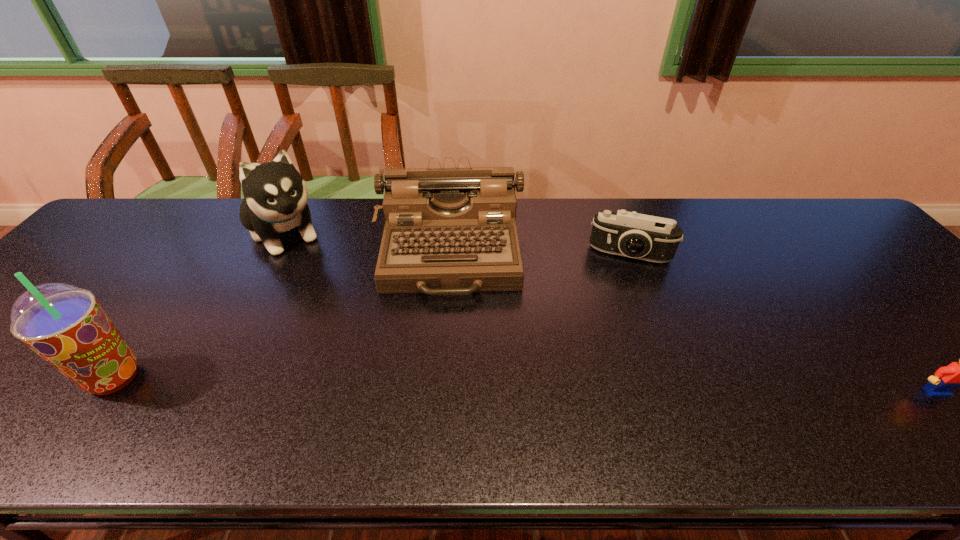
Locate an element on the screen. smoothie that is positioned at the near edge is located at coordinates (64, 324).

Find the location of a particular element. Image resolution: width=960 pixels, height=540 pixels. Lego situated at the near edge is located at coordinates (957, 374).

You are a GUI agent. You are given a task and a screenshot of the screen. Output one action in this format:
    pyautogui.click(x=<x>, y=<y>)
    Task: Click on the object positioned at the right edge
    
    Given the screenshot: What is the action you would take?
    pyautogui.click(x=957, y=374)

Where is `object that is at the near right corner`? The width and height of the screenshot is (960, 540). object that is at the near right corner is located at coordinates (957, 374).

Where is `vacant space at the far edge of the desktop`? This screenshot has height=540, width=960. vacant space at the far edge of the desktop is located at coordinates (208, 242).

This screenshot has width=960, height=540. In the image, there is a desktop. Find the location of `vacant space at the near edge`. vacant space at the near edge is located at coordinates (48, 386).

The image size is (960, 540). In order to click on blank space at the right edge in this screenshot , I will do `click(911, 294)`.

This screenshot has height=540, width=960. Find the location of `free space at the far left corner of the desktop`. free space at the far left corner of the desktop is located at coordinates point(119,231).

Where is `vacant space at the far right corner of the desktop`? vacant space at the far right corner of the desktop is located at coordinates (802, 231).

The image size is (960, 540). I want to click on vacant point located between the typewriter and the puppy, so click(x=367, y=242).